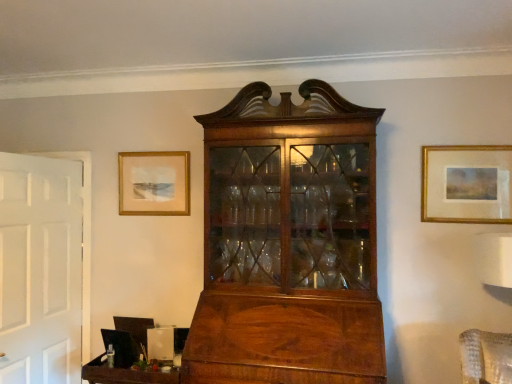
Question: Can you confirm if wooden tray at lower left is positioned to the right of gold-framed painting at upper right, which ranks as the 2th picture frame in back-to-front order?

Choices:
 (A) no
 (B) yes

Answer: (A)

Question: Does wooden tray at lower left have a smaller size compared to gold-framed painting at upper right, which ranks as the 2th picture frame in back-to-front order?

Choices:
 (A) yes
 (B) no

Answer: (B)

Question: From a real-world perspective, is wooden tray at lower left below gold-framed painting at upper right, which ranks as the 2th picture frame in back-to-front order?

Choices:
 (A) yes
 (B) no

Answer: (A)

Question: From the image's perspective, does wooden tray at lower left appear higher than gold-framed painting at upper right, which is counted as the first picture frame, starting from the front?

Choices:
 (A) yes
 (B) no

Answer: (B)

Question: Does wooden tray at lower left appear on the left side of gold-framed painting at upper right, which is counted as the first picture frame, starting from the front?

Choices:
 (A) no
 (B) yes

Answer: (B)

Question: From the image's perspective, is wooden tray at lower left beneath gold-framed painting at upper right, which ranks as the 2th picture frame in back-to-front order?

Choices:
 (A) no
 (B) yes

Answer: (B)

Question: Is wooden tray at lower left behind matte gold picture frame at upper left, the 1th picture frame positioned from the left?

Choices:
 (A) no
 (B) yes

Answer: (A)

Question: Is wooden tray at lower left taller than matte gold picture frame at upper left, the 1th picture frame positioned from the left?

Choices:
 (A) yes
 (B) no

Answer: (B)

Question: Can you confirm if wooden tray at lower left is smaller than matte gold picture frame at upper left, the 1th picture frame positioned from the left?

Choices:
 (A) no
 (B) yes

Answer: (A)

Question: Considering the relative positions of wooden tray at lower left and matte gold picture frame at upper left, which is the second picture frame from front to back, in the image provided, is wooden tray at lower left to the right of matte gold picture frame at upper left, which is the second picture frame from front to back, from the viewer's perspective?

Choices:
 (A) no
 (B) yes

Answer: (B)

Question: Can you confirm if wooden tray at lower left is positioned to the left of matte gold picture frame at upper left, the first picture frame in the back-to-front sequence?

Choices:
 (A) no
 (B) yes

Answer: (A)

Question: Is wooden tray at lower left not within matte gold picture frame at upper left, which is the second picture frame from front to back?

Choices:
 (A) no
 (B) yes

Answer: (B)

Question: From a real-world perspective, is gold-framed painting at upper right, acting as the 1th picture frame starting from the right, over matte gold picture frame at upper left, the 1th picture frame positioned from the left?

Choices:
 (A) no
 (B) yes

Answer: (A)